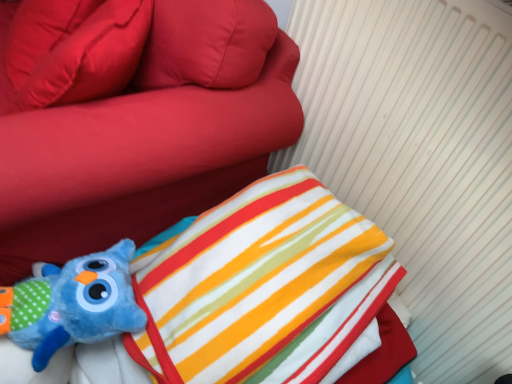
Question: Considering the relative positions of soft plush toy at lower left and matte red pillow at upper left in the image provided, is soft plush toy at lower left to the left of matte red pillow at upper left from the viewer's perspective?

Choices:
 (A) yes
 (B) no

Answer: (A)

Question: Is the depth of soft plush toy at lower left less than that of matte red pillow at upper left?

Choices:
 (A) no
 (B) yes

Answer: (B)

Question: Considering the relative sizes of soft plush toy at lower left and matte red pillow at upper left in the image provided, is soft plush toy at lower left smaller than matte red pillow at upper left?

Choices:
 (A) no
 (B) yes

Answer: (A)

Question: Does soft plush toy at lower left contain matte red pillow at upper left?

Choices:
 (A) yes
 (B) no

Answer: (A)

Question: Considering the relative positions of soft plush toy at lower left and matte red pillow at upper left in the image provided, is soft plush toy at lower left to the right of matte red pillow at upper left from the viewer's perspective?

Choices:
 (A) no
 (B) yes

Answer: (A)

Question: Is soft plush toy at lower left beside matte red pillow at upper left?

Choices:
 (A) yes
 (B) no

Answer: (B)

Question: Can you confirm if matte red pillow at upper left is positioned to the left of blue plush toy at lower left?

Choices:
 (A) no
 (B) yes

Answer: (B)

Question: Does matte red pillow at upper left have a lesser width compared to blue plush toy at lower left?

Choices:
 (A) yes
 (B) no

Answer: (B)

Question: Does matte red pillow at upper left lie in front of blue plush toy at lower left?

Choices:
 (A) no
 (B) yes

Answer: (A)

Question: Is the position of matte red pillow at upper left more distant than that of blue plush toy at lower left?

Choices:
 (A) no
 (B) yes

Answer: (B)

Question: Considering the relative sizes of matte red pillow at upper left and blue plush toy at lower left in the image provided, is matte red pillow at upper left smaller than blue plush toy at lower left?

Choices:
 (A) yes
 (B) no

Answer: (B)

Question: Is matte red pillow at upper left taller than blue plush toy at lower left?

Choices:
 (A) yes
 (B) no

Answer: (A)

Question: Can you confirm if soft plush toy at lower left is positioned to the left of blue plush toy at lower left?

Choices:
 (A) yes
 (B) no

Answer: (A)